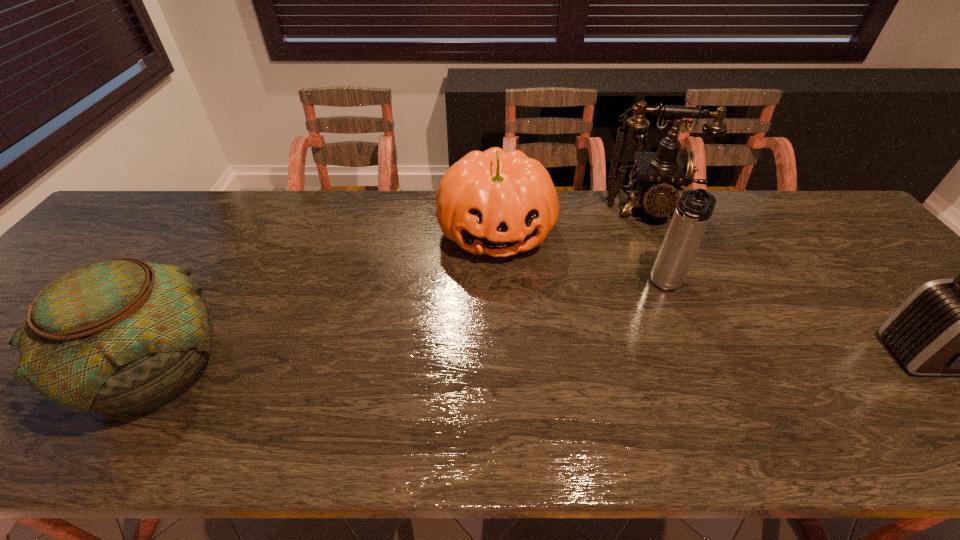
I want to click on the leftmost object, so click(x=120, y=335).

The width and height of the screenshot is (960, 540). Identify the location of pumpkin. (499, 203).

This screenshot has height=540, width=960. Identify the location of thermos bottle. (693, 212).

At what (x,y) coordinates should I click in order to perform the action: click on telephone. Please return your answer as a coordinate pair (x, y). Image resolution: width=960 pixels, height=540 pixels. Looking at the image, I should click on (660, 175).

Locate an element on the screen. vacant space located 0.330m on the right of the leftmost object is located at coordinates (380, 369).

This screenshot has width=960, height=540. In order to click on free space located on the carved face of the fourth object from right to left in this screenshot , I will do `click(515, 336)`.

Where is `vacant region located 0.260m on the carved face of the fourth object from right to left`? vacant region located 0.260m on the carved face of the fourth object from right to left is located at coordinates (516, 350).

Locate an element on the screen. This screenshot has height=540, width=960. free spot located 0.290m on the carved face of the fourth object from right to left is located at coordinates (518, 362).

This screenshot has width=960, height=540. What are the coordinates of `vacant point located on the handle side of the thermos bottle` in the screenshot? It's located at (633, 366).

The image size is (960, 540). Identify the location of vacant space located on the handle side of the thermos bottle. (632, 369).